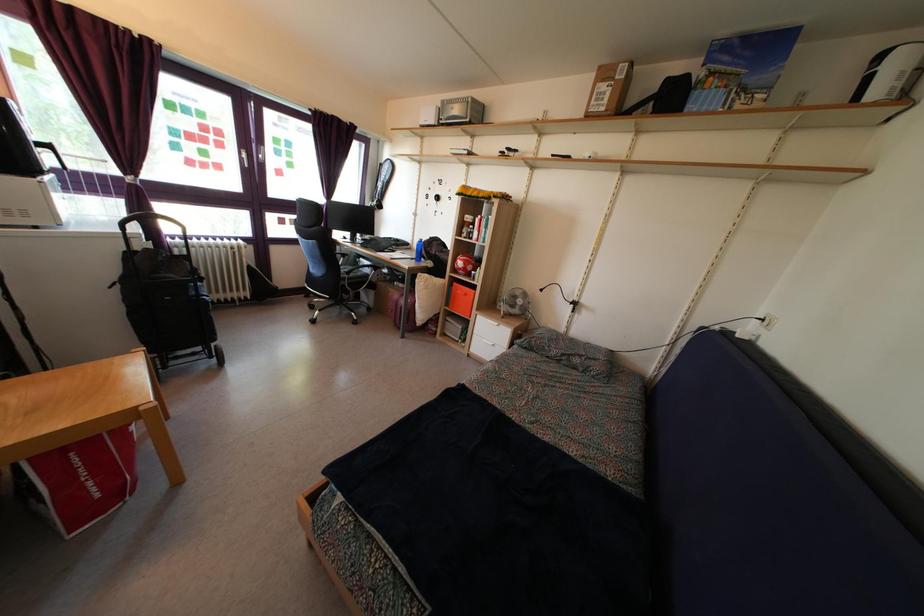
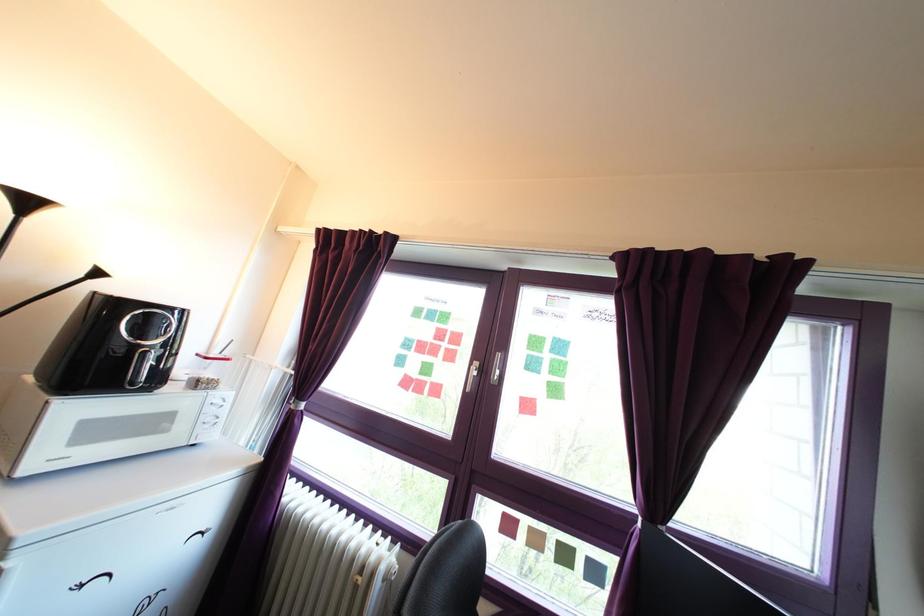
Locate, in the second image, the point that corresponds to (146,225) in the first image.

(219, 479)